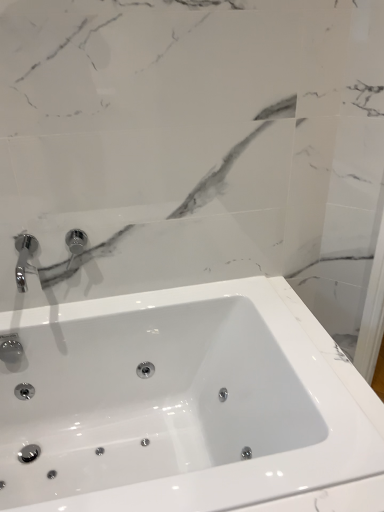
Question: From a real-world perspective, relative to white glossy sink at center, is chrome metallic faucet at upper left vertically above or below?

Choices:
 (A) above
 (B) below

Answer: (A)

Question: Looking at their shapes, would you say chrome metallic faucet at upper left is wider or thinner than white glossy sink at center?

Choices:
 (A) wide
 (B) thin

Answer: (B)

Question: Is chrome metallic faucet at upper left bigger or smaller than white glossy sink at center?

Choices:
 (A) big
 (B) small

Answer: (B)

Question: In terms of height, does white glossy sink at center look taller or shorter compared to chrome metallic faucet at upper left?

Choices:
 (A) short
 (B) tall

Answer: (B)

Question: Is white glossy sink at center situated inside chrome metallic faucet at upper left or outside?

Choices:
 (A) outside
 (B) inside

Answer: (A)

Question: Is white glossy sink at center in front of or behind chrome metallic faucet at upper left in the image?

Choices:
 (A) front
 (B) behind

Answer: (A)

Question: Is point (155, 371) positioned closer to the camera than point (21, 247)?

Choices:
 (A) closer
 (B) farther

Answer: (B)